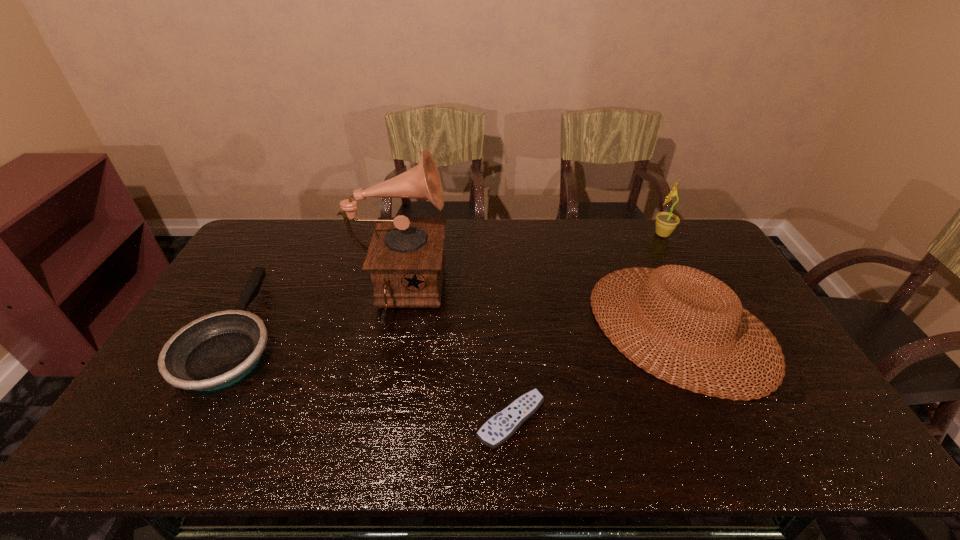
What are the coordinates of `free space between the shortest object and the farthest object` in the screenshot? It's located at (587, 327).

Where is `free point between the second tallest object and the shortest object`? The width and height of the screenshot is (960, 540). free point between the second tallest object and the shortest object is located at coordinates (587, 327).

Where is `vacant area between the third shortest object and the second shortest object`? Image resolution: width=960 pixels, height=540 pixels. vacant area between the third shortest object and the second shortest object is located at coordinates (459, 329).

The height and width of the screenshot is (540, 960). Find the location of `vacant space in between the second object from left to right and the sunhat`. vacant space in between the second object from left to right and the sunhat is located at coordinates 539,311.

Where is `blank region between the frying pan and the tallest object`? Image resolution: width=960 pixels, height=540 pixels. blank region between the frying pan and the tallest object is located at coordinates point(318,314).

This screenshot has height=540, width=960. In order to click on blank region between the third object from right to left and the leftmost object in this screenshot , I will do `click(374, 375)`.

Find the location of `empty space that is in between the fourth tallest object and the second tallest object`. empty space that is in between the fourth tallest object and the second tallest object is located at coordinates (450, 283).

The image size is (960, 540). Identify the location of object identified as the third closest to the sunflower. (500, 427).

Select which object appears as the closest to the sunhat. Please provide its 2D coordinates. Your answer should be formatted as a tuple, i.e. [(x, y)], where the tuple contains the x and y coordinates of a point satisfying the conditions above.

[(666, 222)]

At what (x,y) coordinates should I click in order to perform the action: click on vacant region that satisfies the following two spatial constraints: 1. on the horn of the third tallest object; 2. on the left side of the fourth object from right to left. Please return your answer as a coordinate pair (x, y). The height and width of the screenshot is (540, 960). Looking at the image, I should click on (392, 326).